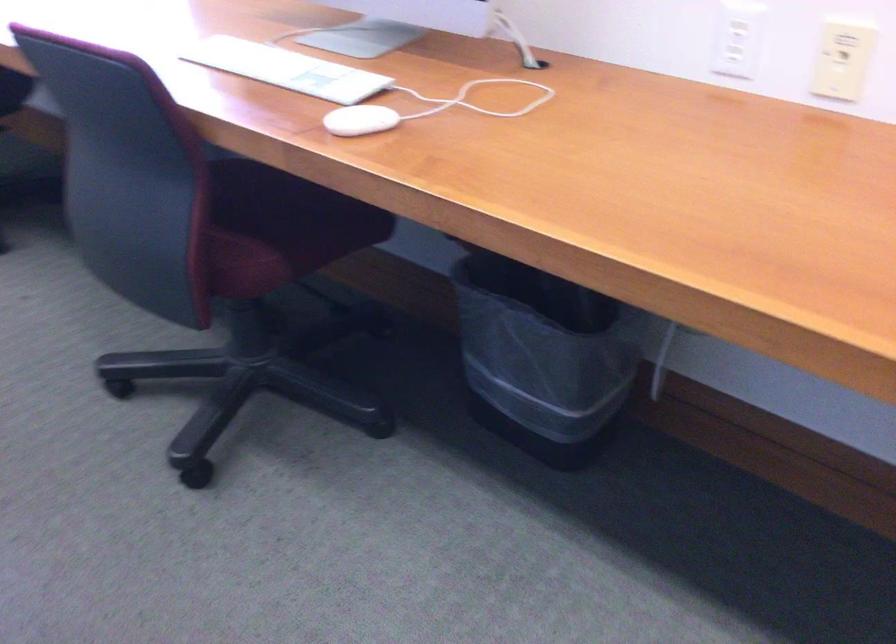
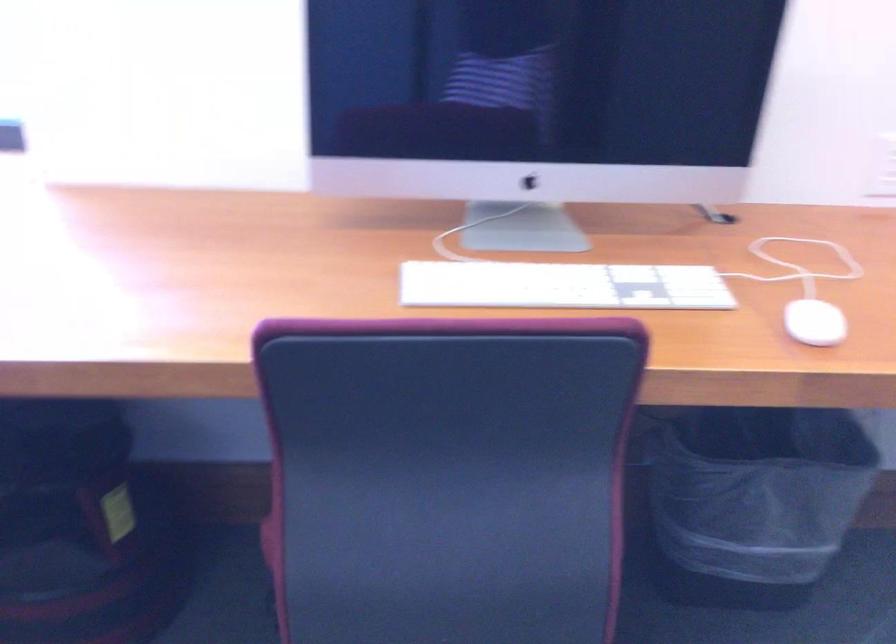
Locate, in the second image, the point that corresponds to point 276,69 in the first image.

(562, 285)